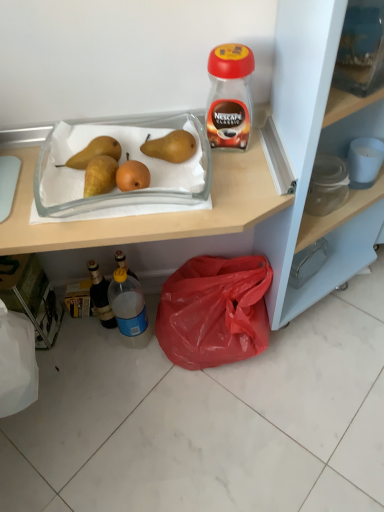
The image size is (384, 512). Find the location of `free spot to the left of translucent plastic bottle at lower left, acting as the first bottle starting from the left`. free spot to the left of translucent plastic bottle at lower left, acting as the first bottle starting from the left is located at coordinates (69, 335).